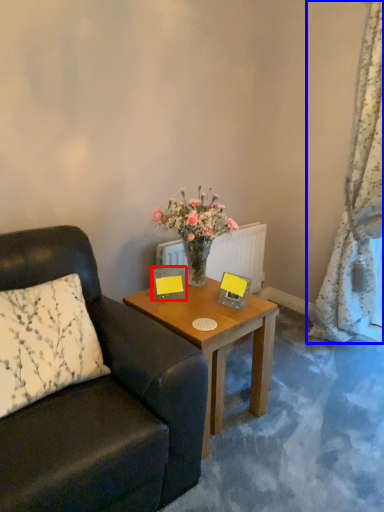
Question: Among these objects, which one is farthest to the camera, picture frame (highlighted by a red box) or curtain (highlighted by a blue box)?

Choices:
 (A) picture frame
 (B) curtain

Answer: (A)